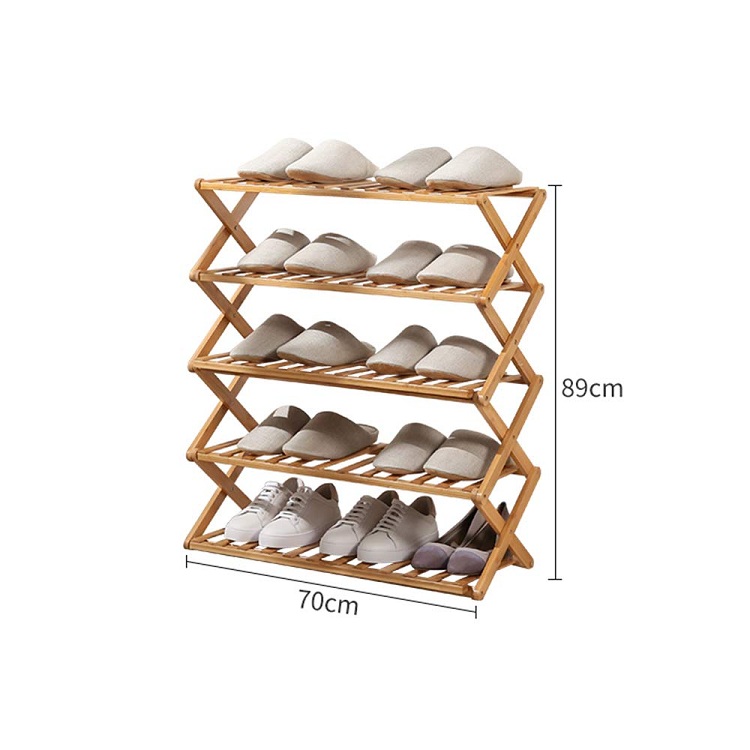
Locate an element on the screen. The width and height of the screenshot is (750, 750). racks is located at coordinates (438, 588), (453, 488), (450, 297), (438, 387), (422, 198).